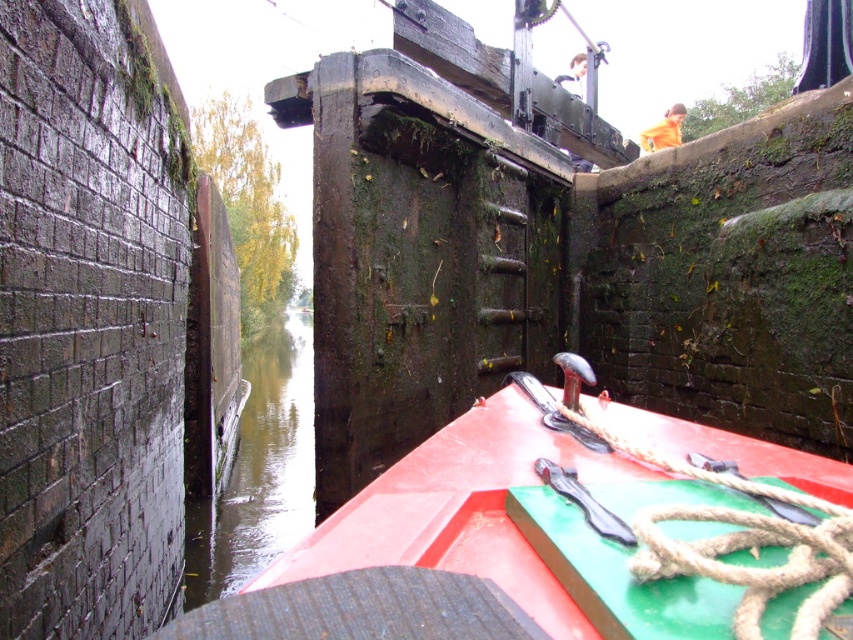
Can you confirm if red matte boat at center is positioned above greenish water at center?

Correct, red matte boat at center is located above greenish water at center.

This screenshot has width=853, height=640. I want to click on red matte boat at center, so click(515, 524).

Where is `red matte boat at center`? This screenshot has width=853, height=640. red matte boat at center is located at coordinates coord(515,524).

How distant is red matte boat at center from roperoughrope at center?

A distance of 23.49 centimeters exists between red matte boat at center and roperoughrope at center.

Between point (625, 596) and point (788, 627), which one is positioned in front?

Positioned in front is point (788, 627).

The image size is (853, 640). Identify the location of red matte boat at center. (515, 524).

Who is lower down, roperoughrope at center or greenish water at center?

Positioned lower is greenish water at center.

Is point (541, 420) farther from viewer compared to point (305, 374)?

No, it is in front of (305, 374).

Find the location of a particular element. The image size is (853, 640). roperoughrope at center is located at coordinates (630, 556).